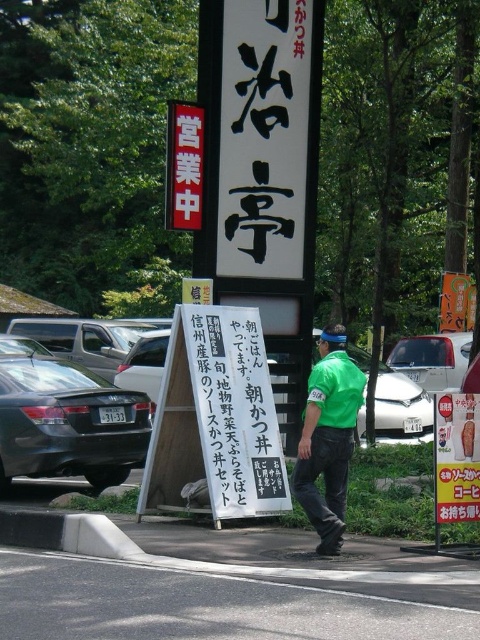
You are a tourist standing in front of the main sign and want to read both the black paper sign at center and the green fabric shirt at center. Which object is taller?

The black paper sign at center is taller than the green fabric shirt at center according to the description.

You are a delivery person standing in front of the street scene. You need to place a package on the black paper sign at center and the green fabric shirt at center. Which object can you place the package on without it hanging over the edge?

The black paper sign at center has a greater width than the green fabric shirt at center, so placing the package on the black paper sign at center would prevent it from hanging over the edge.

You are a tourist in Japan and want to read the signs to find out if the restaurant is open. You notice the black paper sign at center and the green fabric shirt at center. Which one is bigger?

The black paper sign at center is larger in size than the green fabric shirt at center, so the black paper sign at center is bigger.